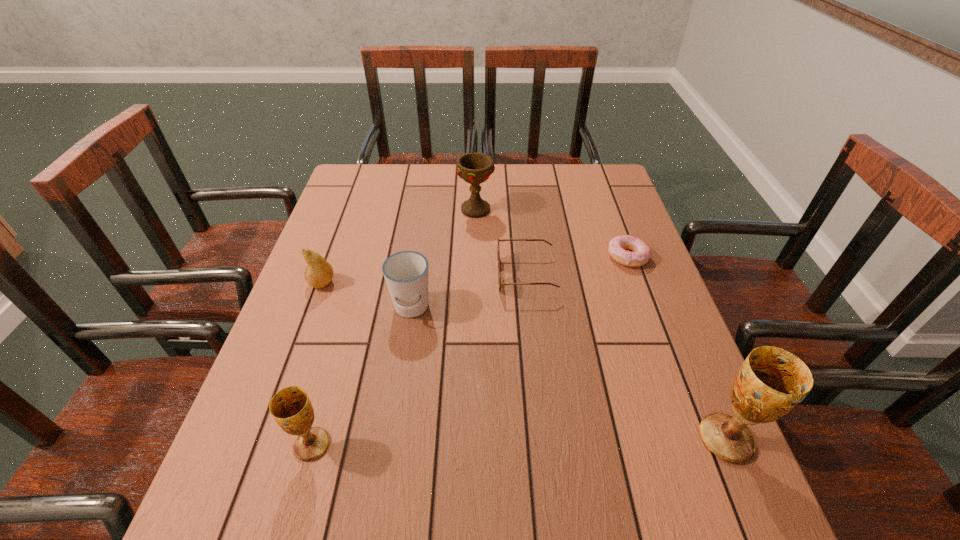
You are a GUI agent. You are given a task and a screenshot of the screen. Output one action in this format:
    pyautogui.click(x=<x>, y=<y>)
    Task: Click on the vacant region at the far left corner
    This screenshot has height=540, width=960.
    Given the screenshot: What is the action you would take?
    pyautogui.click(x=364, y=165)

At what (x,y) coordinates should I click in order to perform the action: click on vacant space that is in between the fifth object from right to left and the second shortest object. Please return your answer as a coordinate pair (x, y). The image size is (960, 540). Looking at the image, I should click on (468, 292).

Where is `vacant point located between the fourth object from right to left and the leftmost object`? The width and height of the screenshot is (960, 540). vacant point located between the fourth object from right to left and the leftmost object is located at coordinates (399, 246).

At what (x,y) coordinates should I click in order to perform the action: click on free space between the shortest object and the leftmost chalice. Please return your answer as a coordinate pair (x, y). The height and width of the screenshot is (540, 960). Looking at the image, I should click on (469, 351).

Find the location of a particular element. Image resolution: width=960 pixels, height=540 pixels. vacant point located between the leftmost chalice and the tallest object is located at coordinates (519, 442).

At what (x,y) coordinates should I click in order to perform the action: click on vacant space that's between the tallest object and the second chalice from left to right. Please return your answer as a coordinate pair (x, y). The image size is (960, 540). Looking at the image, I should click on (601, 324).

Identify the location of free space that is in between the spectacles and the second object from left to right. (419, 360).

The height and width of the screenshot is (540, 960). I want to click on unoccupied position between the third object from right to left and the tallest object, so click(x=626, y=357).

The width and height of the screenshot is (960, 540). I want to click on free space between the farthest chalice and the rightmost chalice, so click(601, 324).

You are a GUI agent. You are given a task and a screenshot of the screen. Output one action in this format:
    pyautogui.click(x=<x>, y=<y>)
    Task: Click on the free space that is in between the doughnut and the leftmost chalice
    
    Given the screenshot: What is the action you would take?
    pyautogui.click(x=469, y=351)